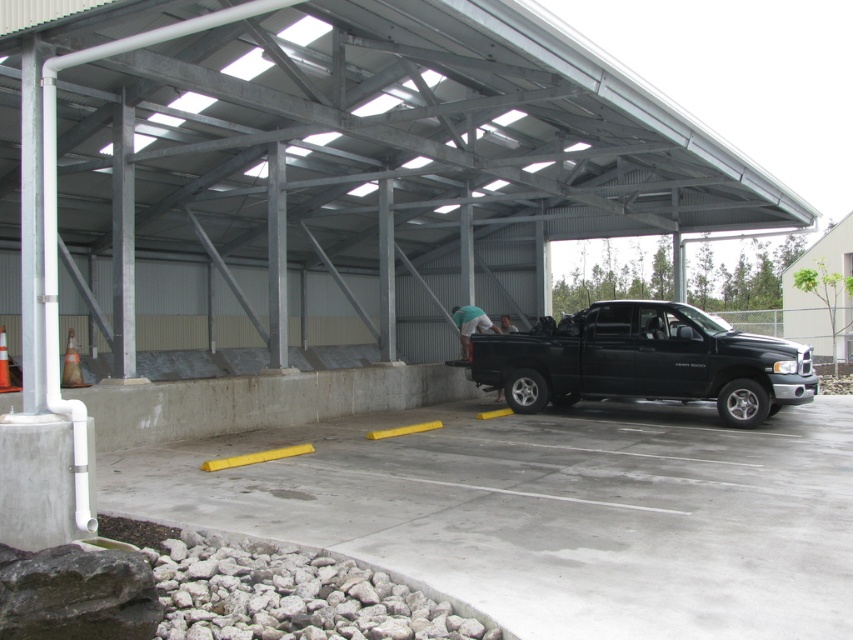
Question: Which object appears farthest from the camera in this image?

Choices:
 (A) concrete at center
 (B) black matte truck at center

Answer: (B)

Question: Can you confirm if concrete at center is positioned to the left of black matte truck at center?

Choices:
 (A) yes
 (B) no

Answer: (A)

Question: Considering the relative positions of concrete at center and black matte truck at center in the image provided, where is concrete at center located with respect to black matte truck at center?

Choices:
 (A) left
 (B) right

Answer: (A)

Question: Can you confirm if concrete at center is positioned to the left of black matte truck at center?

Choices:
 (A) no
 (B) yes

Answer: (B)